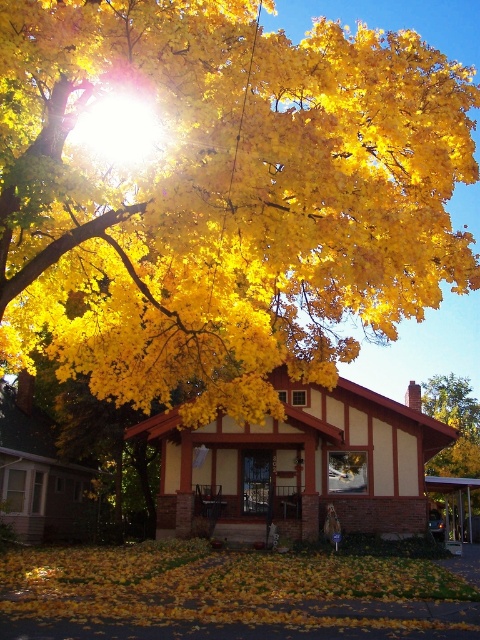
Can you confirm if golden yellow leaves at upper center is shorter than yellow dry leaves at lower center?

Incorrect, golden yellow leaves at upper center's height does not fall short of yellow dry leaves at lower center's.

Is point (240, 253) positioned behind point (285, 566)?

No, it is in front of (285, 566).

Where is `golden yellow leaves at upper center`? golden yellow leaves at upper center is located at coordinates (219, 195).

Is golden yellow leaves at upper center thinner than yellow matte tree at center?

In fact, golden yellow leaves at upper center might be wider than yellow matte tree at center.

I want to click on golden yellow leaves at upper center, so click(219, 195).

Where is `golden yellow leaves at upper center`? golden yellow leaves at upper center is located at coordinates (219, 195).

Does yellow dry leaves at lower center appear on the right side of yellow matte tree at center?

No, yellow dry leaves at lower center is not to the right of yellow matte tree at center.

Is yellow dry leaves at lower center closer to camera compared to yellow matte tree at center?

Yes, it is.

Is point (423, 561) more distant than point (444, 384)?

That is False.

Locate an element on the screen. Image resolution: width=480 pixels, height=640 pixels. yellow dry leaves at lower center is located at coordinates (233, 595).